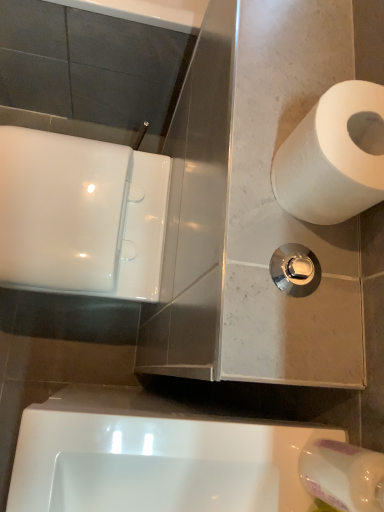
Locate an element on the screen. This screenshot has width=384, height=512. free space in front of polished chrome flush handle at center-right is located at coordinates (259, 330).